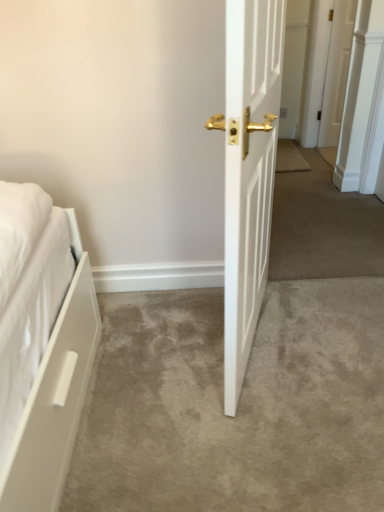
The height and width of the screenshot is (512, 384). Find the location of `vacant space situated above beige carpet at center (from a real-world perspective)`. vacant space situated above beige carpet at center (from a real-world perspective) is located at coordinates (216, 369).